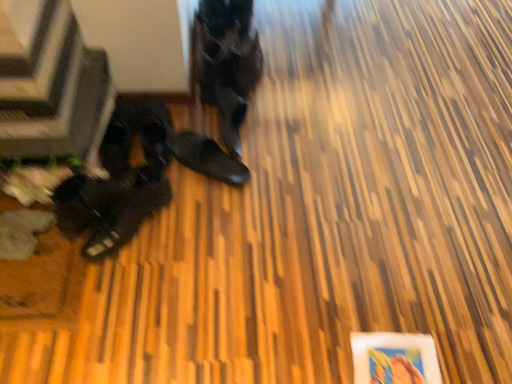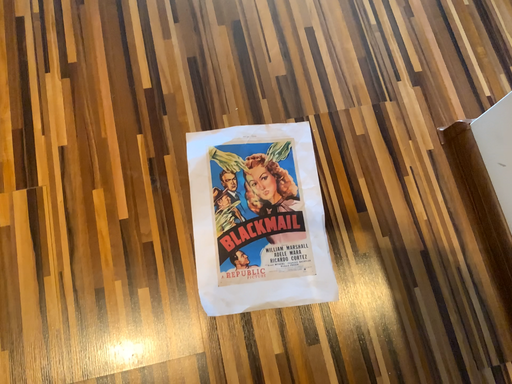
Question: How did the camera likely rotate when shooting the video?

Choices:
 (A) rotated left
 (B) rotated right

Answer: (B)